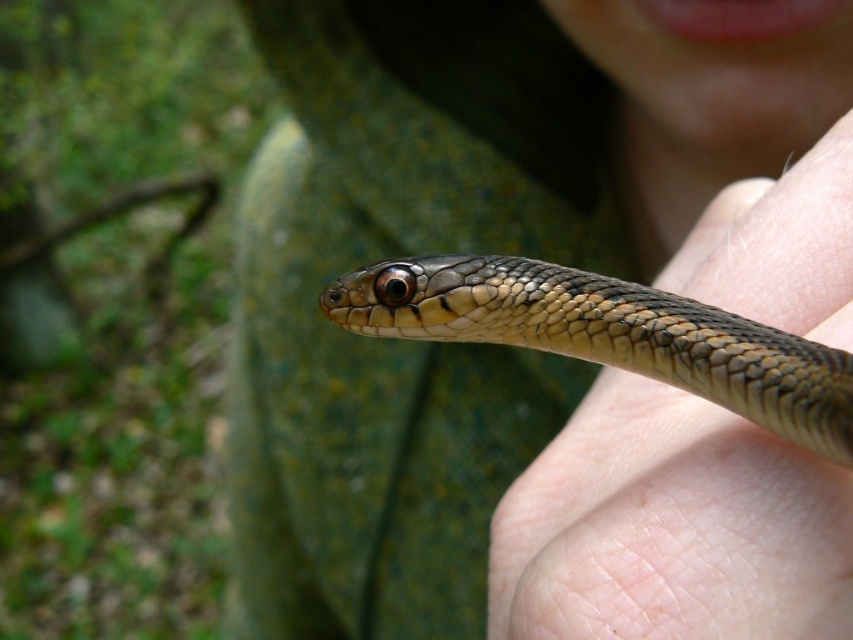
Is smooth skin at center wider than shiny brown snake at center?

Incorrect, smooth skin at center's width does not surpass shiny brown snake at center's.

Is point (709, 410) less distant than point (373, 308)?

Yes, point (709, 410) is closer to viewer.

Is point (575, 445) closer to camera compared to point (788, 368)?

No, it is not.

You are a GUI agent. You are given a task and a screenshot of the screen. Output one action in this format:
    pyautogui.click(x=<x>, y=<y>)
    Task: Click on the smooth skin at center
    The height and width of the screenshot is (640, 853).
    Given the screenshot: What is the action you would take?
    pyautogui.click(x=670, y=529)

Who is taller, smooth skin hand at center or smooth skin at center?

Standing taller between the two is smooth skin hand at center.

Can you confirm if smooth skin hand at center is wider than smooth skin at center?

Yes, smooth skin hand at center is wider than smooth skin at center.

Between point (238, 326) and point (851, 141), which one is positioned behind?

Positioned behind is point (238, 326).

Where is `smooth skin hand at center`? This screenshot has height=640, width=853. smooth skin hand at center is located at coordinates (x=532, y=352).

Does smooth skin hand at center appear on the right side of shiny brown snake at center?

No, smooth skin hand at center is not to the right of shiny brown snake at center.

Is smooth skin hand at center smaller than shiny brown snake at center?

No.

This screenshot has height=640, width=853. Find the location of `smooth skin hand at center`. smooth skin hand at center is located at coordinates (532, 352).

The width and height of the screenshot is (853, 640). Find the location of `smooth skin hand at center`. smooth skin hand at center is located at coordinates (532, 352).